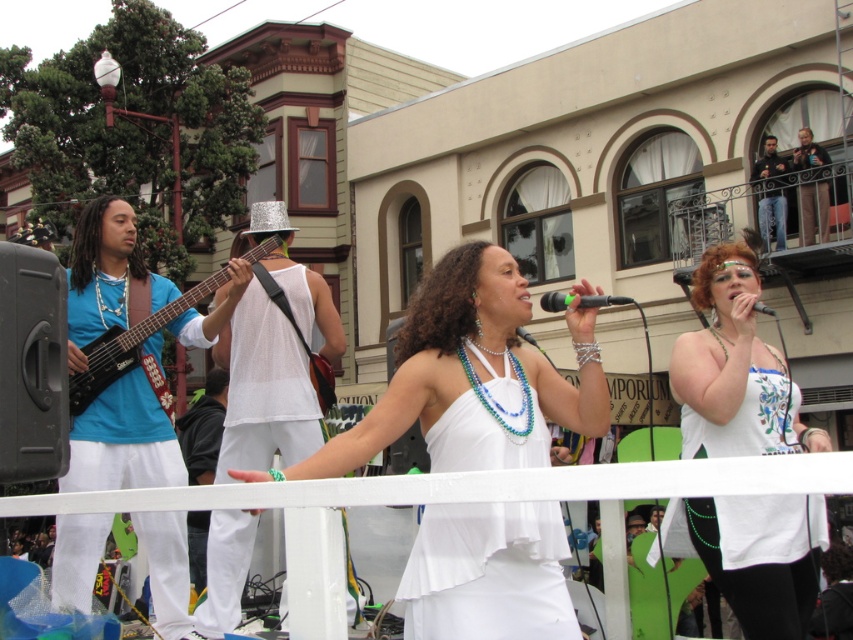
Is point (463, 614) farther from camera compared to point (578, 368)?

No, it is in front of (578, 368).

Can you confirm if white satin dress at center is positioned below white matte microphone at center?

Indeed, white satin dress at center is positioned under white matte microphone at center.

Is point (407, 371) positioned after point (585, 348)?

No.

Locate an element on the screen. Image resolution: width=853 pixels, height=640 pixels. white satin dress at center is located at coordinates tap(463, 365).

Can you confirm if matte black electric guitar at left is bigger than white matte microphone at center?

Yes.

Which is behind, point (99, 385) or point (585, 356)?

The point (99, 385) is more distant.

Is point (106, 385) closer to camera compared to point (589, 355)?

That is False.

Find the location of a particular element. matte black electric guitar at left is located at coordinates (126, 346).

Who is more distant from viewer, (743, 534) or (573, 344)?

The point (743, 534) is more distant.

Between white fabric dress at center and white matte microphone at center, which one appears on the left side from the viewer's perspective?

white matte microphone at center

Measure the distance between white fabric dress at center and camera.

They are 40.35 feet apart.

Where is `white fabric dress at center`? white fabric dress at center is located at coordinates (734, 369).